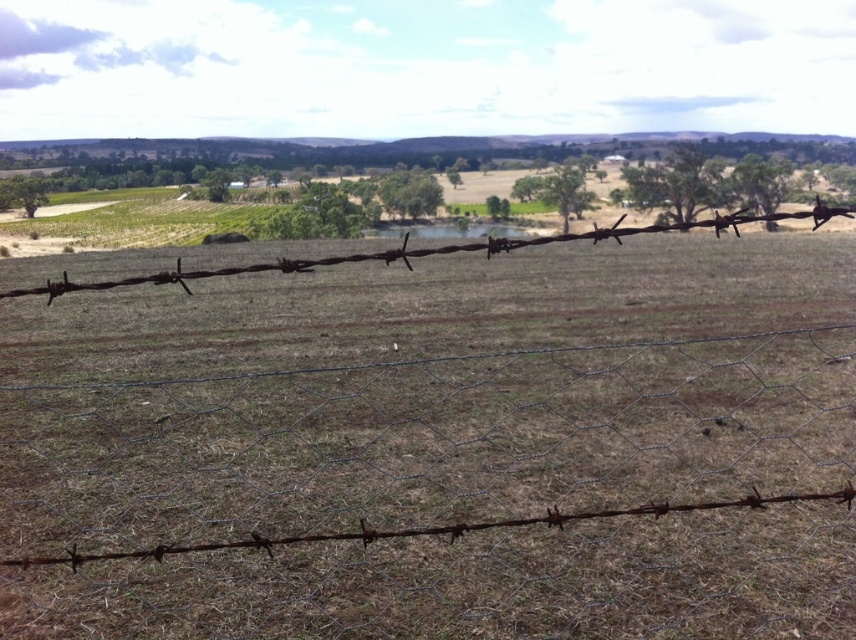
Is rusty wire fence at center bigger than rusty wire at center?

Incorrect, rusty wire fence at center is not larger than rusty wire at center.

Which is below, rusty wire fence at center or rusty wire at center?

Positioned lower is rusty wire fence at center.

Is point (280, 385) more distant than point (679, 227)?

Yes, it is behind point (679, 227).

Locate an element on the screen. rusty wire fence at center is located at coordinates (443, 448).